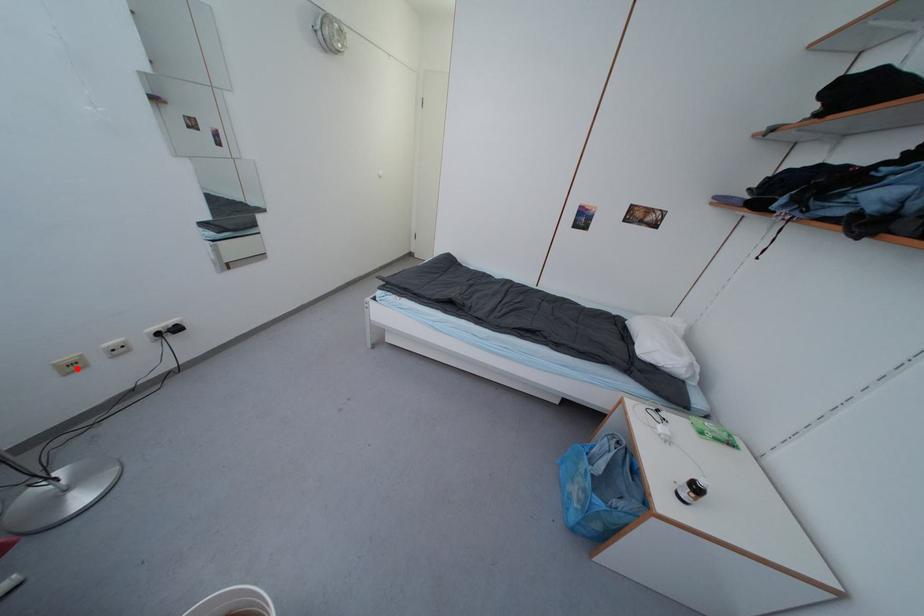
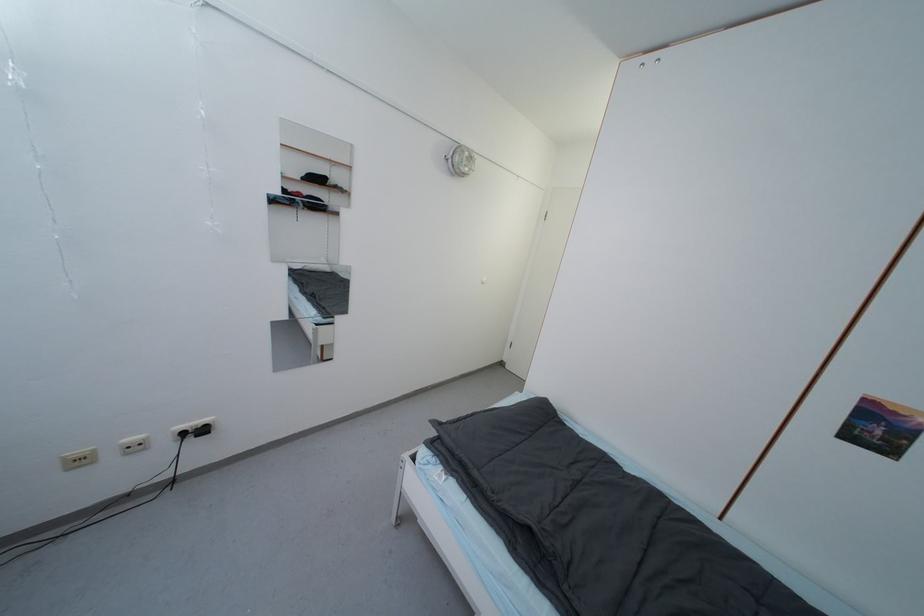
In the second image, find the point that corresponds to the highlighted location in the first image.

(83, 464)